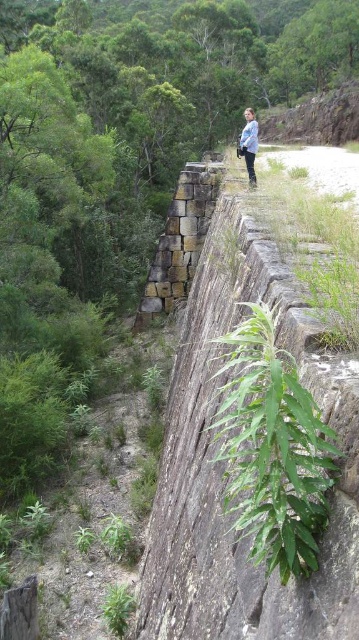
Based on the photo, is green leafy plant at center behind blue denim jacket at upper center?

No, green leafy plant at center is in front of blue denim jacket at upper center.

Can you confirm if green leafy plant at center is positioned to the right of blue denim jacket at upper center?

In fact, green leafy plant at center is to the left of blue denim jacket at upper center.

This screenshot has height=640, width=359. Identify the location of green leafy plant at center. (272, 449).

This screenshot has width=359, height=640. What are the coordinates of `green leafy plant at center` in the screenshot? It's located at (272, 449).

Measure the distance between point (231,340) and camera.

4.81 meters

Does green leafy plant at center have a greater height compared to brown rough stone at center?

In fact, green leafy plant at center may be shorter than brown rough stone at center.

Is point (263, 397) closer to camera compared to point (210, 170)?

That is True.

Locate an element on the screen. The image size is (359, 640). green leafy plant at center is located at coordinates (272, 449).

Which of these two, brown rough stone at center or blue denim jacket at upper center, stands shorter?

brown rough stone at center is shorter.

Is brown rough stone at center to the left of blue denim jacket at upper center from the viewer's perspective?

Correct, you'll find brown rough stone at center to the left of blue denim jacket at upper center.

Who is more forward, (154, 282) or (243, 154)?

Positioned in front is point (243, 154).

In order to click on brown rough stone at center in this screenshot , I will do `click(180, 237)`.